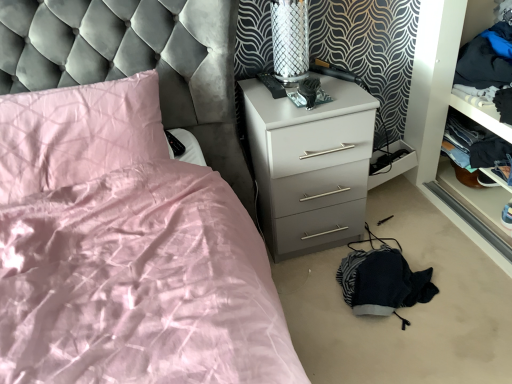
This screenshot has width=512, height=384. I want to click on free point above white glossy chest of drawers at center (from a real-world perspective), so click(297, 91).